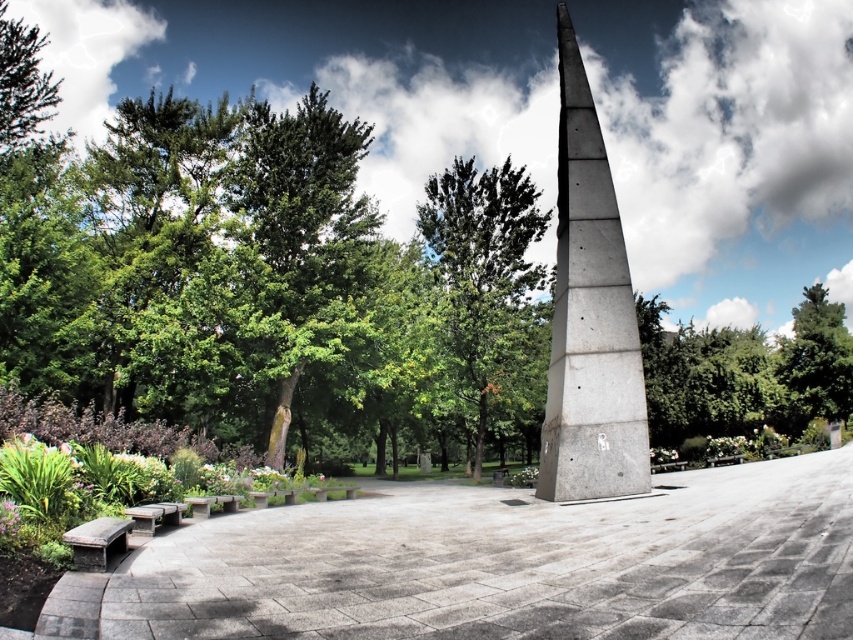
You are a park visitor who wants to sit down. You see the gray concrete bench at lower left and the wooden bench at lower left. Which one is closer to you?

The gray concrete bench at lower left is 3.87 meters away from wooden bench at lower left. Since both are at the same lower left position, their distance from you depends on their arrangement. However, the description only provides the distance between them, not their individual distances from you. Therefore, it is impossible to determine which is closer without additional information.

You are planning to place a 3m long picnic blanket on the ground between the gray concrete bench at lower left and the green leafy tree at center. Considering their widths, will the blanket fit horizontally between them?

The gray concrete bench at lower left is wider than the green leafy tree at center. Since the bench is wider, the distance between them might be sufficient for the 3m blanket, but the exact fit depends on their actual spacing. However, based on width comparison alone, the bench being wider suggests there is enough space.